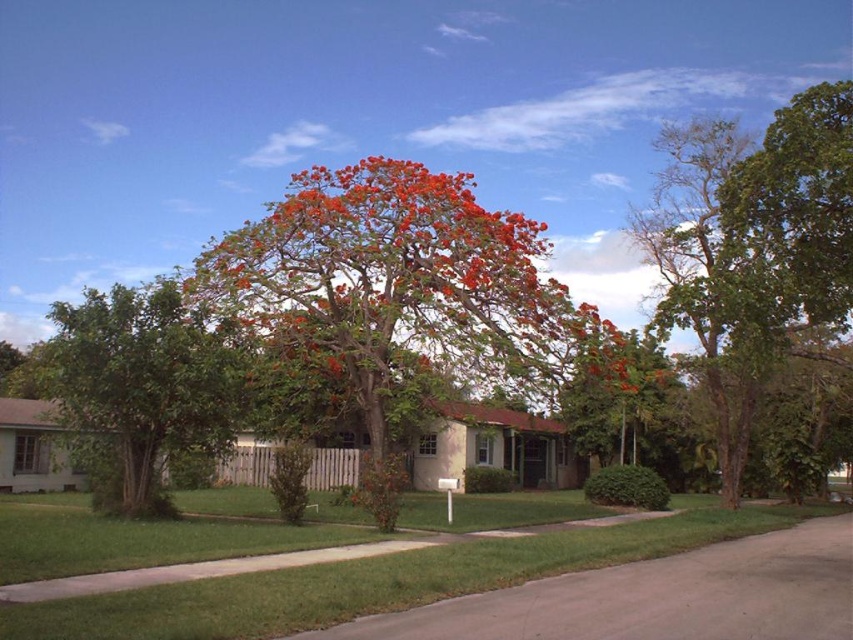
Question: Which of these objects is positioned farthest from the green grass at center?

Choices:
 (A) orange leafy tree at center
 (B) green leafy tree at center
 (C) bright orange blossoms at center
 (D) green leafy tree at right

Answer: (D)

Question: Which object is the closest to the green leafy tree at center?

Choices:
 (A) orange leafy tree at center
 (B) green grass at center
 (C) green leafy tree at right
 (D) bright orange blossoms at center

Answer: (D)

Question: Where is bright orange blossoms at center located in relation to green grass at center in the image?

Choices:
 (A) left
 (B) right

Answer: (A)

Question: Which object is positioned closest to the green leafy tree at center?

Choices:
 (A) green grass at center
 (B) bright orange blossoms at center
 (C) orange leafy tree at center

Answer: (B)

Question: Does bright orange blossoms at center have a greater width compared to orange leafy tree at center?

Choices:
 (A) yes
 (B) no

Answer: (A)

Question: Does green grass at center lie behind green leafy tree at center?

Choices:
 (A) yes
 (B) no

Answer: (B)